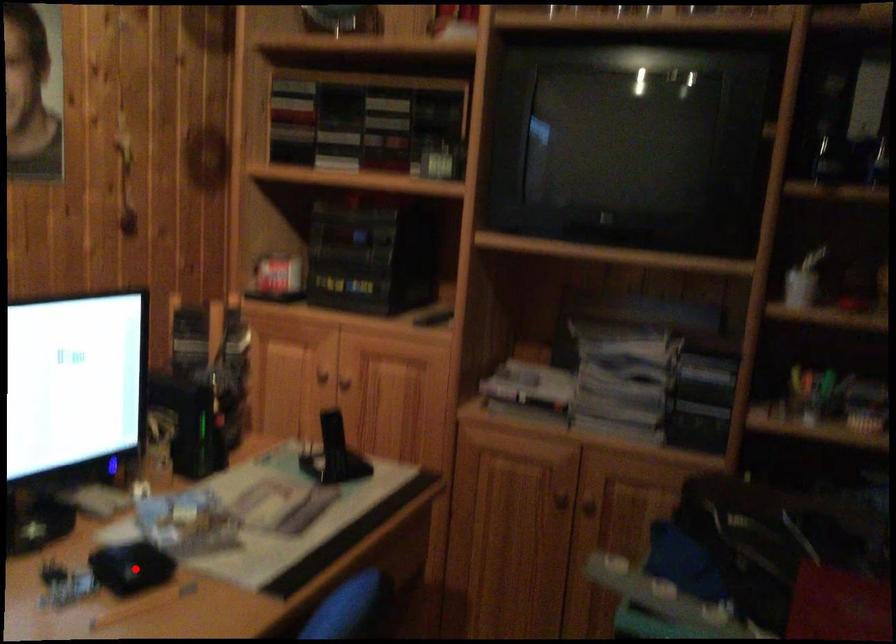
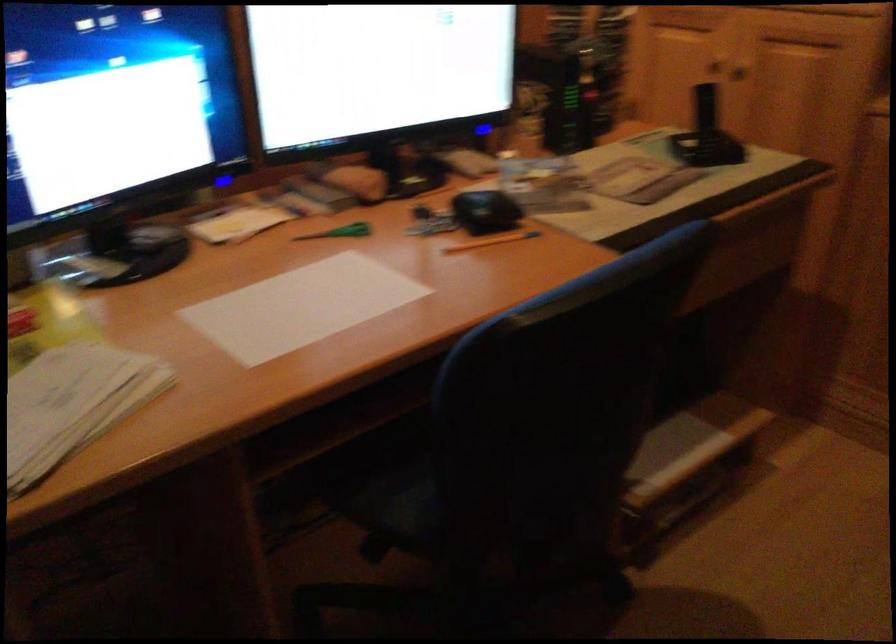
Question: I am providing you with two images of the same scene from different viewpoints. A red point is marked on the first image. Is the red point's position out of view in image 2?

Choices:
 (A) Yes
 (B) No

Answer: (B)